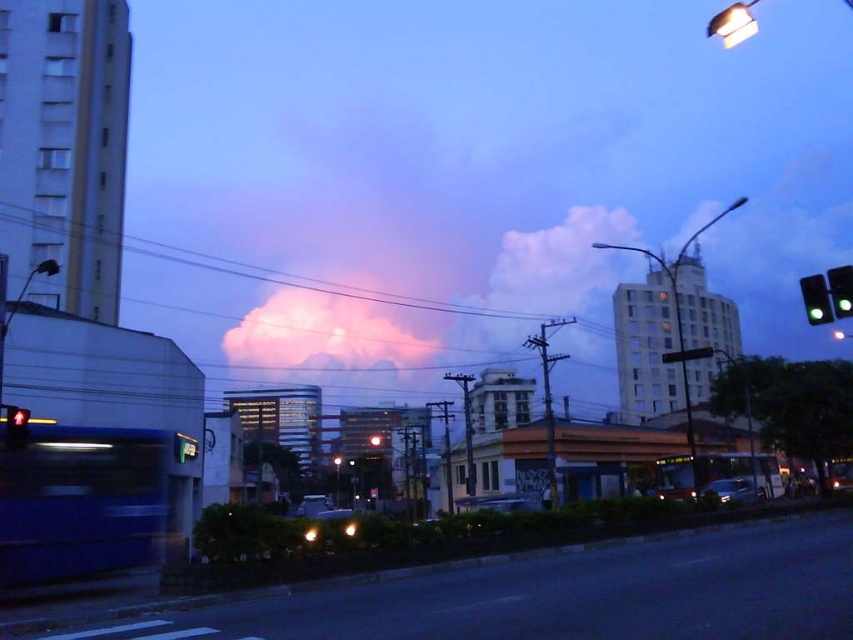
Question: Estimate the real-world distances between objects in this image. Which object is farther from the pink fluffy cloud at upper center?

Choices:
 (A) green glass traffic light at upper right
 (B) red glass pedestrian signal at left

Answer: (B)

Question: Considering the relative positions of green glass traffic light at upper right and red glass pedestrian signal at left in the image provided, where is green glass traffic light at upper right located with respect to red glass pedestrian signal at left?

Choices:
 (A) above
 (B) below

Answer: (A)

Question: Which object is closer to the camera taking this photo?

Choices:
 (A) red glass pedestrian signal at left
 (B) green glass traffic light at upper right

Answer: (A)

Question: Which object is the farthest from the red glass pedestrian signal at left?

Choices:
 (A) pink fluffy cloud at upper center
 (B) green glass traffic light at upper right

Answer: (A)

Question: Is green glass traffic light at upper right further to the viewer compared to red glass pedestrian signal at left?

Choices:
 (A) yes
 (B) no

Answer: (A)

Question: Is green glass traffic light at upper right further to the viewer compared to red glass pedestrian signal at left?

Choices:
 (A) yes
 (B) no

Answer: (A)